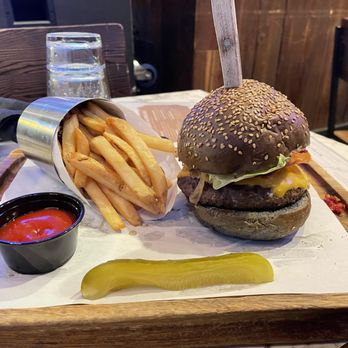
I want to click on tipped over silver cup, so click(x=53, y=111).